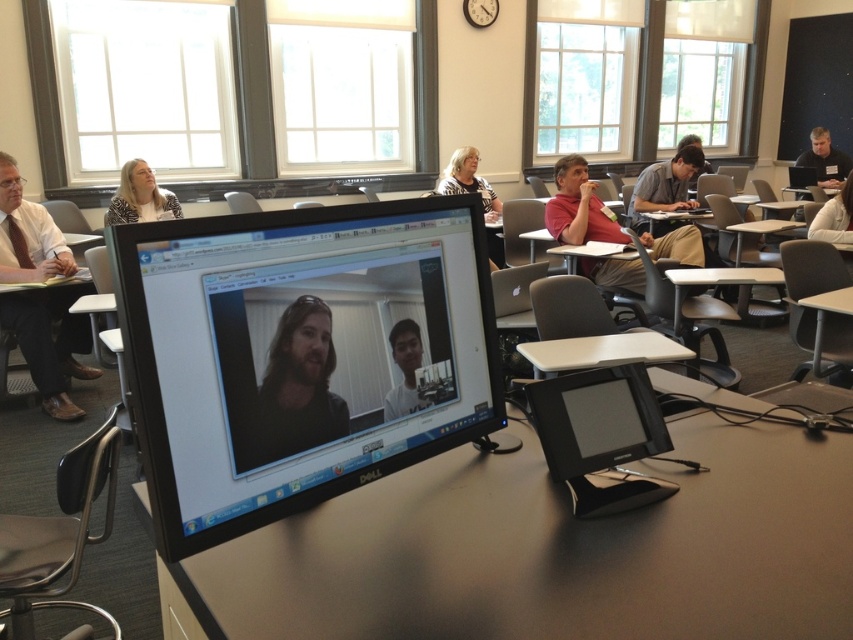
Question: Does smooth skin face at center have a larger size compared to light brown hair at upper center?

Choices:
 (A) yes
 (B) no

Answer: (B)

Question: Among these points, which one is nearest to the camera?

Choices:
 (A) (691, 132)
 (B) (289, 435)

Answer: (B)

Question: Among these objects, which one is farthest from the camera?

Choices:
 (A) black plastic monitor at lower center
 (B) white plastic table at lower right

Answer: (B)

Question: Does dark matte hair at center have a lesser width compared to white plastic table at lower right?

Choices:
 (A) no
 (B) yes

Answer: (B)

Question: In this image, where is black glossy monitor at center located relative to dark matte hair at center?

Choices:
 (A) below
 (B) above

Answer: (B)

Question: Which point appears farthest from the camera in this image?

Choices:
 (A) (502, 426)
 (B) (616, 486)
 (C) (450, 170)

Answer: (C)